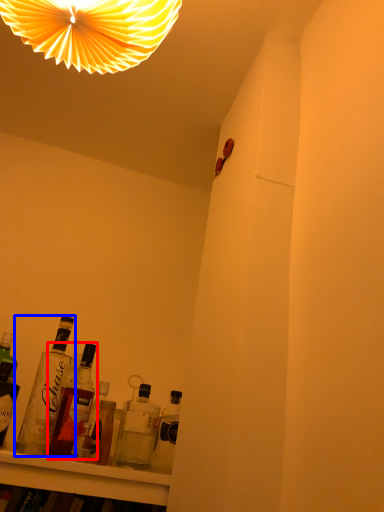
Question: Which of the following is the closest to the observer, bottle (highlighted by a red box) or bottle (highlighted by a blue box)?

Choices:
 (A) bottle
 (B) bottle

Answer: (B)